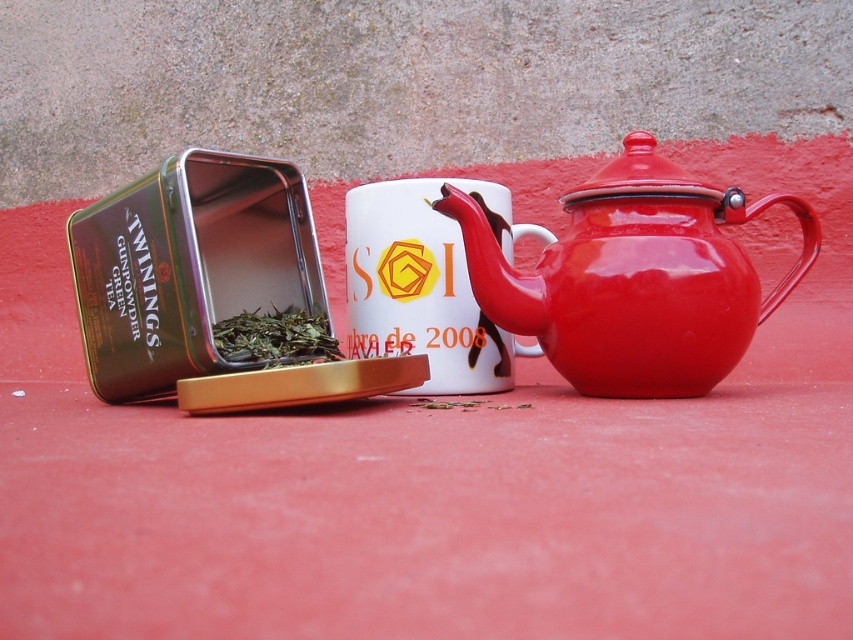
Is shiny enamel teapot at center right positioned in front of white glossy mug at center?

Yes, shiny enamel teapot at center right is in front of white glossy mug at center.

Which is in front, point (163, 326) or point (389, 333)?

Point (163, 326)

What are the coordinates of `shiny enamel teapot at center right` in the screenshot? It's located at (213, 291).

Describe the element at coordinates (634, 276) in the screenshot. I see `glossy enamel teapot at center` at that location.

Is point (590, 266) farther from camera compared to point (436, 288)?

No, (590, 266) is closer to viewer.

Locate an element on the screen. glossy enamel teapot at center is located at coordinates (634, 276).

Who is more forward, (164,280) or (567,205)?

Point (164,280)

What do you see at coordinates (213, 291) in the screenshot? I see `shiny enamel teapot at center right` at bounding box center [213, 291].

Identify the location of shiny enamel teapot at center right. pyautogui.click(x=213, y=291).